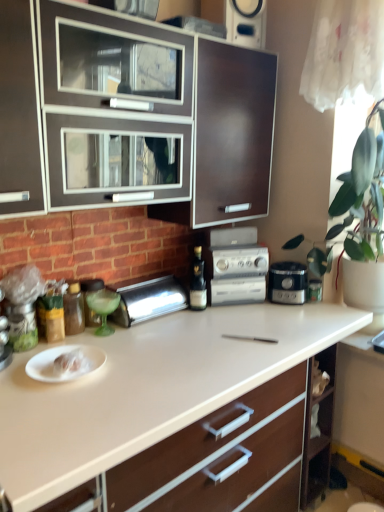
The image size is (384, 512). What are the coordinates of `unoccupied region to the right of brown glass bottle at left, placed as the 2th bottle when sorted from right to left` in the screenshot? It's located at (127, 334).